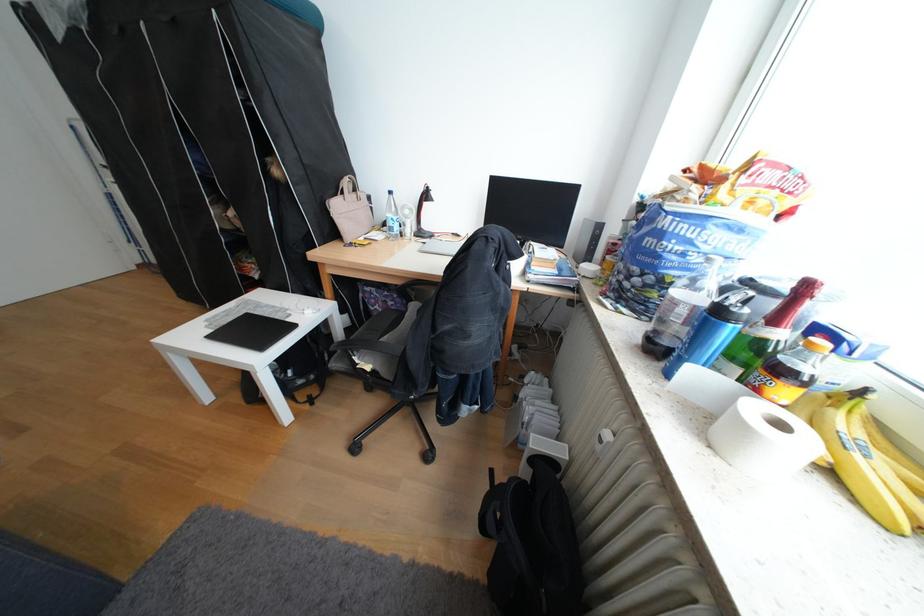
The location [531,208] corresponds to which object?

It refers to a black closed laptop.